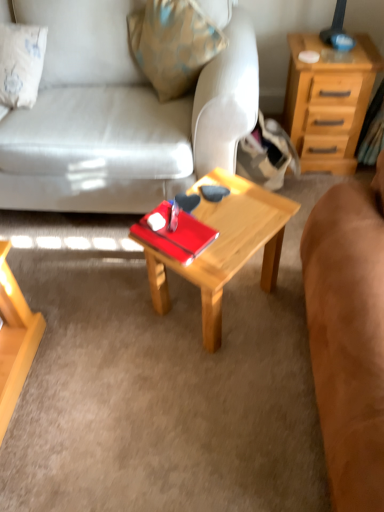
The image size is (384, 512). What do you see at coordinates (226, 247) in the screenshot?
I see `wooden coffee table at center` at bounding box center [226, 247].

Identify the location of wooden coffee table at center. The image size is (384, 512). (226, 247).

Is brown suede couch at center, which is the 2th studio couch in left-to-right order, aimed at wooden coffee table at center?

Yes, brown suede couch at center, which is the 2th studio couch in left-to-right order, is turned towards wooden coffee table at center.

Considering the relative sizes of brown suede couch at center, which is the 2th studio couch in left-to-right order, and wooden coffee table at center in the image provided, is brown suede couch at center, which is the 2th studio couch in left-to-right order, thinner than wooden coffee table at center?

Yes, brown suede couch at center, which is the 2th studio couch in left-to-right order, is thinner than wooden coffee table at center.

Consider the image. How different are the orientations of brown suede couch at center, which is the 2th studio couch in left-to-right order, and wooden coffee table at center in degrees?

The angular difference between brown suede couch at center, which is the 2th studio couch in left-to-right order, and wooden coffee table at center is 57.1 degrees.

Considering the relative sizes of brown suede couch at center, which is the 2th studio couch in left-to-right order, and wooden coffee table at center in the image provided, is brown suede couch at center, which is the 2th studio couch in left-to-right order, smaller than wooden coffee table at center?

No, brown suede couch at center, which is the 2th studio couch in left-to-right order, is not smaller than wooden coffee table at center.

Is light brown wood nightstand at upper right at the right side of matte white couch at center, the second studio couch in the right-to-left sequence?

Indeed, light brown wood nightstand at upper right is positioned on the right side of matte white couch at center, the second studio couch in the right-to-left sequence.

Locate an element on the screen. Image resolution: width=384 pixels, height=512 pixels. studio couch above the light brown wood nightstand at upper right (from the image's perspective) is located at coordinates (92, 120).

Is the surface of light brown wood nightstand at upper right in direct contact with matte white couch at center, marked as the 1th studio couch in a left-to-right arrangement?

light brown wood nightstand at upper right and matte white couch at center, marked as the 1th studio couch in a left-to-right arrangement, are clearly separated.

What's the angular difference between light brown wood nightstand at upper right and matte white couch at center, marked as the 1th studio couch in a left-to-right arrangement,'s facing directions?

1.71 degrees.

Is brown suede couch at center, which appears as the first studio couch when viewed from the right, looking in the opposite direction of matte white couch at center, marked as the 1th studio couch in a left-to-right arrangement?

brown suede couch at center, which appears as the first studio couch when viewed from the right, does not have its back to matte white couch at center, marked as the 1th studio couch in a left-to-right arrangement.

Looking at the image, does brown suede couch at center, which appears as the first studio couch when viewed from the right, seem bigger or smaller compared to matte white couch at center, marked as the 1th studio couch in a left-to-right arrangement?

Clearly, brown suede couch at center, which appears as the first studio couch when viewed from the right, is smaller in size than matte white couch at center, marked as the 1th studio couch in a left-to-right arrangement.

Is brown suede couch at center, which is the 2th studio couch in left-to-right order, positioned beyond the bounds of matte white couch at center, the second studio couch in the right-to-left sequence?

That's correct, brown suede couch at center, which is the 2th studio couch in left-to-right order, is outside of matte white couch at center, the second studio couch in the right-to-left sequence.

Consider the image. Considering the relative sizes of matte white couch at center, the second studio couch in the right-to-left sequence, and wooden coffee table at center in the image provided, is matte white couch at center, the second studio couch in the right-to-left sequence, shorter than wooden coffee table at center?

Incorrect, the height of matte white couch at center, the second studio couch in the right-to-left sequence, does not fall short of that of wooden coffee table at center.

From a real-world perspective, does matte white couch at center, marked as the 1th studio couch in a left-to-right arrangement, sit lower than wooden coffee table at center?

No, from a real-world perspective, matte white couch at center, marked as the 1th studio couch in a left-to-right arrangement, is not under wooden coffee table at center.

Is matte white couch at center, the second studio couch in the right-to-left sequence, smaller than wooden coffee table at center?

No, matte white couch at center, the second studio couch in the right-to-left sequence, is not smaller than wooden coffee table at center.

From the image's perspective, is matte white couch at center, the second studio couch in the right-to-left sequence, above or below light brown wood nightstand at upper right?

Clearly, from the image's perspective, matte white couch at center, the second studio couch in the right-to-left sequence, is above light brown wood nightstand at upper right.

Which object is further away from the camera taking this photo, matte white couch at center, the second studio couch in the right-to-left sequence, or light brown wood nightstand at upper right?

light brown wood nightstand at upper right is further away from the camera.

Is point (103, 187) positioned before point (310, 94)?

Yes, point (103, 187) is closer to viewer.

Considering the relative sizes of matte white couch at center, marked as the 1th studio couch in a left-to-right arrangement, and light brown wood nightstand at upper right in the image provided, is matte white couch at center, marked as the 1th studio couch in a left-to-right arrangement, smaller than light brown wood nightstand at upper right?

Actually, matte white couch at center, marked as the 1th studio couch in a left-to-right arrangement, might be larger than light brown wood nightstand at upper right.

Are brown suede couch at center, which is the 2th studio couch in left-to-right order, and light brown wood nightstand at upper right making contact?

No, brown suede couch at center, which is the 2th studio couch in left-to-right order, is not touching light brown wood nightstand at upper right.

Between point (361, 383) and point (290, 71), which one is positioned behind?

The point (290, 71) is farther.

Does brown suede couch at center, which appears as the first studio couch when viewed from the right, have a smaller size compared to light brown wood nightstand at upper right?

Actually, brown suede couch at center, which appears as the first studio couch when viewed from the right, might be larger than light brown wood nightstand at upper right.

Considering the sizes of objects brown suede couch at center, which is the 2th studio couch in left-to-right order, and light brown wood nightstand at upper right in the image provided, who is taller, brown suede couch at center, which is the 2th studio couch in left-to-right order, or light brown wood nightstand at upper right?

With more height is brown suede couch at center, which is the 2th studio couch in left-to-right order.

Is light brown wood nightstand at upper right located within wooden coffee table at center?

No, light brown wood nightstand at upper right is not a part of wooden coffee table at center.

Is wooden coffee table at center positioned before light brown wood nightstand at upper right?

Yes.

Locate an element on the screen. This screenshot has height=512, width=384. coffee table below the brown suede couch at center, which is the 2th studio couch in left-to-right order (from a real-world perspective) is located at coordinates (226, 247).

This screenshot has height=512, width=384. In the image, there is a light brown wood nightstand at upper right. In order to click on studio couch above it (from the image's perspective) in this screenshot , I will do `click(92, 120)`.

Considering their positions, is light brown wood nightstand at upper right positioned further to wooden coffee table at center than brown suede couch at center, which is the 2th studio couch in left-to-right order?

The object further to wooden coffee table at center is light brown wood nightstand at upper right.

From the image, which object appears to be farther from light brown wood nightstand at upper right, wooden coffee table at center or matte white couch at center, the second studio couch in the right-to-left sequence?

matte white couch at center, the second studio couch in the right-to-left sequence.

From the image, which object appears to be farther from matte white couch at center, marked as the 1th studio couch in a left-to-right arrangement, brown suede couch at center, which is the 2th studio couch in left-to-right order, or wooden coffee table at center?

brown suede couch at center, which is the 2th studio couch in left-to-right order, lies further to matte white couch at center, marked as the 1th studio couch in a left-to-right arrangement, than the other object.

Based on their spatial positions, is brown suede couch at center, which appears as the first studio couch when viewed from the right, or wooden coffee table at center closer to light brown wood nightstand at upper right?

wooden coffee table at center.

Consider the image. Looking at the image, which one is located closer to light brown wood nightstand at upper right, brown suede couch at center, which is the 2th studio couch in left-to-right order, or matte white couch at center, marked as the 1th studio couch in a left-to-right arrangement?

Among the two, matte white couch at center, marked as the 1th studio couch in a left-to-right arrangement, is located nearer to light brown wood nightstand at upper right.

Estimate the real-world distances between objects in this image. Which object is further from brown suede couch at center, which appears as the first studio couch when viewed from the right, wooden coffee table at center or light brown wood nightstand at upper right?

light brown wood nightstand at upper right is positioned further to the anchor brown suede couch at center, which appears as the first studio couch when viewed from the right.

From the image, which object appears to be farther from matte white couch at center, marked as the 1th studio couch in a left-to-right arrangement, light brown wood nightstand at upper right or wooden coffee table at center?

Based on the image, light brown wood nightstand at upper right appears to be further to matte white couch at center, marked as the 1th studio couch in a left-to-right arrangement.

Estimate the real-world distances between objects in this image. Which object is further from wooden coffee table at center, brown suede couch at center, which is the 2th studio couch in left-to-right order, or matte white couch at center, the second studio couch in the right-to-left sequence?

matte white couch at center, the second studio couch in the right-to-left sequence, lies further to wooden coffee table at center than the other object.

What are the coordinates of `studio couch between brown suede couch at center, which is the 2th studio couch in left-to-right order, and light brown wood nightstand at upper right from front to back` in the screenshot? It's located at (92, 120).

Image resolution: width=384 pixels, height=512 pixels. Find the location of `coffee table situated between matte white couch at center, the second studio couch in the right-to-left sequence, and light brown wood nightstand at upper right from left to right`. coffee table situated between matte white couch at center, the second studio couch in the right-to-left sequence, and light brown wood nightstand at upper right from left to right is located at coordinates (226, 247).

The image size is (384, 512). Identify the location of coffee table located between brown suede couch at center, which appears as the first studio couch when viewed from the right, and light brown wood nightstand at upper right in the depth direction. (226, 247).

Where is `studio couch between brown suede couch at center, which is the 2th studio couch in left-to-right order, and wooden coffee table at center from front to back`? studio couch between brown suede couch at center, which is the 2th studio couch in left-to-right order, and wooden coffee table at center from front to back is located at coordinates (92, 120).